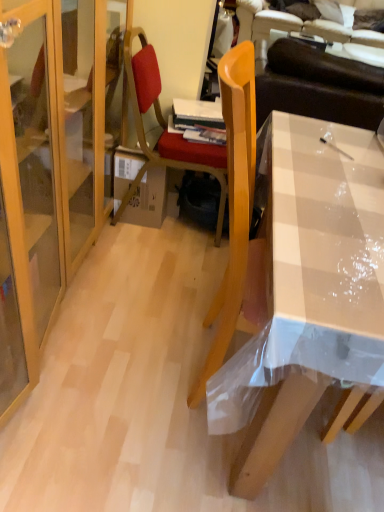
Image resolution: width=384 pixels, height=512 pixels. I want to click on empty space that is ontop of clear plastic desk at center (from a real-world perspective), so click(335, 179).